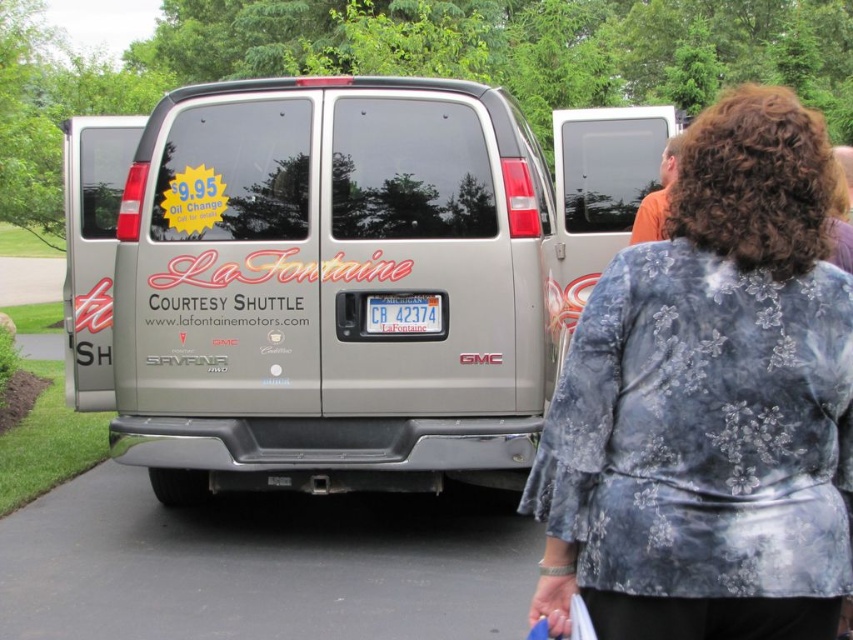
Can you confirm if silver metallic van at center is taller than blue plastic license plate at center?

Yes, silver metallic van at center is taller than blue plastic license plate at center.

Is point (525, 436) closer to camera compared to point (374, 292)?

Yes, point (525, 436) is in front of point (374, 292).

I want to click on silver metallic van at center, so click(331, 288).

Locate an element on the screen. silver metallic van at center is located at coordinates (331, 288).

Can you confirm if floral-patterned fabric at center is positioned to the right of blue plastic license plate at center?

Correct, you'll find floral-patterned fabric at center to the right of blue plastic license plate at center.

Is floral-patterned fabric at center closer to camera compared to blue plastic license plate at center?

Yes, it is.

This screenshot has width=853, height=640. What do you see at coordinates (709, 403) in the screenshot?
I see `floral-patterned fabric at center` at bounding box center [709, 403].

Where is `floral-patterned fabric at center`? The image size is (853, 640). floral-patterned fabric at center is located at coordinates (709, 403).

Which is behind, point (322, 451) or point (715, 104)?

Point (715, 104)

The height and width of the screenshot is (640, 853). I want to click on silver metallic van at center, so click(x=331, y=288).

Locate an element on the screen. silver metallic van at center is located at coordinates (331, 288).